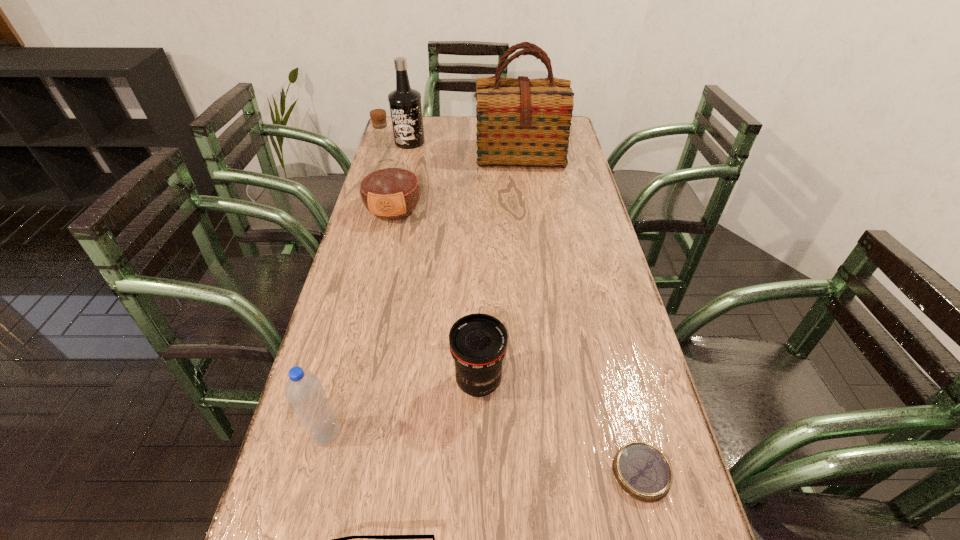
The width and height of the screenshot is (960, 540). What are the coordinates of `free region located 0.230m on the back of the water bottle` in the screenshot? It's located at (352, 332).

Where is `free location located 0.070m on the front of the fourth farthest object`? free location located 0.070m on the front of the fourth farthest object is located at coordinates (478, 437).

You are a GUI agent. You are given a task and a screenshot of the screen. Output one action in this format:
    pyautogui.click(x=<x>, y=<y>)
    Task: Click on the free space located on the left of the shortest object
    
    Given the screenshot: What is the action you would take?
    pyautogui.click(x=423, y=472)

Find the location of a particular element. Image resolution: width=960 pixels, height=540 pixels. shopping bag present at the far edge is located at coordinates (520, 122).

The height and width of the screenshot is (540, 960). In order to click on liquor present at the far edge in this screenshot , I will do click(x=405, y=103).

You are a GUI agent. You are given a task and a screenshot of the screen. Output one action in this format:
    pyautogui.click(x=<x>, y=<y>)
    Task: Click on the water bottle situated at the left edge
    This screenshot has width=960, height=540.
    Given the screenshot: What is the action you would take?
    pyautogui.click(x=306, y=394)

Locate an element on the screen. shopping bag that is at the right edge is located at coordinates (520, 122).

I want to click on compass that is positioned at the right edge, so click(x=642, y=471).

Find the location of a particular element. This screenshot has width=960, height=540. object situated at the far left corner is located at coordinates (405, 103).

Image resolution: width=960 pixels, height=540 pixels. In order to click on object located in the far right corner section of the desktop in this screenshot , I will do 520,122.